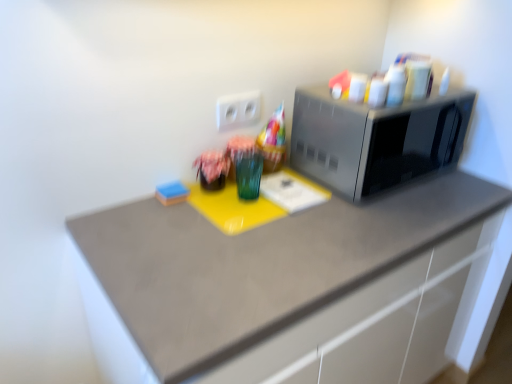
Question: Is blue sponge at lower left in front of matte gray countertop at center?

Choices:
 (A) no
 (B) yes

Answer: (A)

Question: From the image's perspective, does blue sponge at lower left appear higher than matte gray countertop at center?

Choices:
 (A) no
 (B) yes

Answer: (B)

Question: Are blue sponge at lower left and matte gray countertop at center beside each other?

Choices:
 (A) no
 (B) yes

Answer: (A)

Question: Can you confirm if blue sponge at lower left is positioned to the left of matte gray countertop at center?

Choices:
 (A) no
 (B) yes

Answer: (B)

Question: Considering the relative sizes of blue sponge at lower left and matte gray countertop at center in the image provided, is blue sponge at lower left wider than matte gray countertop at center?

Choices:
 (A) yes
 (B) no

Answer: (B)

Question: From a real-world perspective, is blue sponge at lower left under matte gray countertop at center?

Choices:
 (A) no
 (B) yes

Answer: (A)

Question: Considering the relative positions of white plastic electric outlet at center and matte gray countertop at center in the image provided, is white plastic electric outlet at center in front of matte gray countertop at center?

Choices:
 (A) no
 (B) yes

Answer: (A)

Question: From a real-world perspective, is white plastic electric outlet at center on matte gray countertop at center?

Choices:
 (A) yes
 (B) no

Answer: (A)

Question: Are white plastic electric outlet at center and matte gray countertop at center far apart?

Choices:
 (A) no
 (B) yes

Answer: (A)

Question: Does white plastic electric outlet at center come behind matte gray countertop at center?

Choices:
 (A) no
 (B) yes

Answer: (B)

Question: Does white plastic electric outlet at center have a larger size compared to matte gray countertop at center?

Choices:
 (A) no
 (B) yes

Answer: (A)

Question: Is white plastic electric outlet at center at the right side of matte gray countertop at center?

Choices:
 (A) no
 (B) yes

Answer: (A)

Question: Considering the relative sizes of satin silver microwave at right and matte gray countertop at center in the image provided, is satin silver microwave at right smaller than matte gray countertop at center?

Choices:
 (A) yes
 (B) no

Answer: (A)